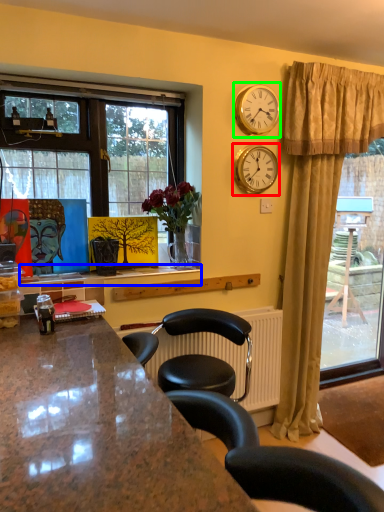
Question: Which is nearer to the clock (highlighted by a red box)? window sill (highlighted by a blue box) or clock (highlighted by a green box).

Choices:
 (A) window sill
 (B) clock

Answer: (B)